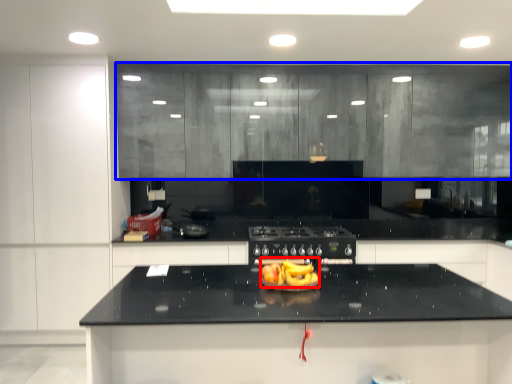
Question: Among these objects, which one is farthest to the camera, food (highlighted by a red box) or cabinetry (highlighted by a blue box)?

Choices:
 (A) food
 (B) cabinetry

Answer: (B)